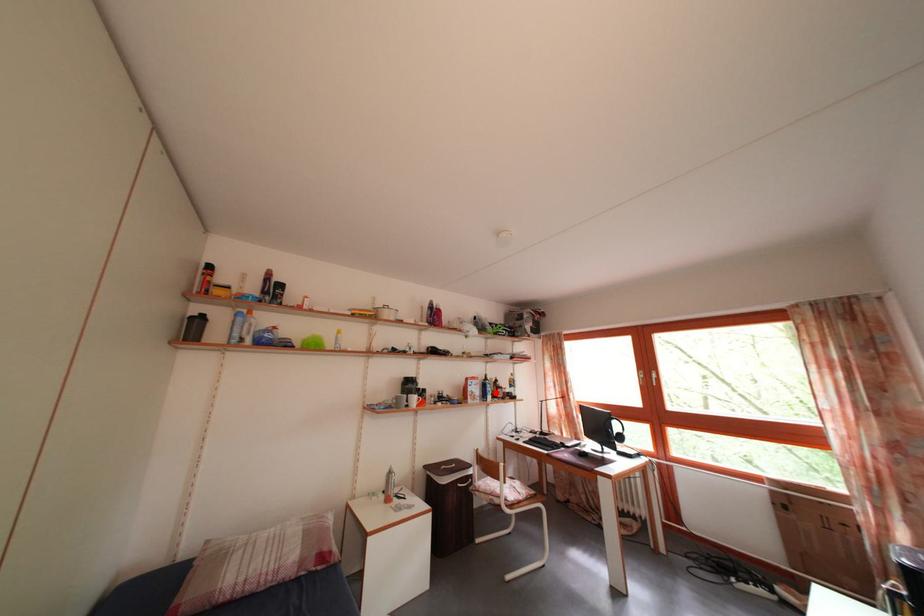
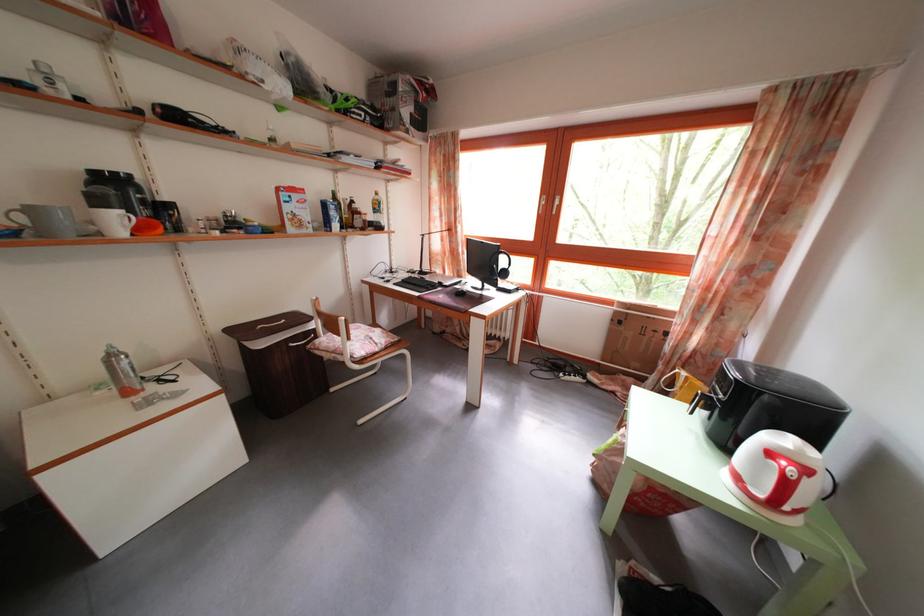
Question: I am providing you with two images of the same scene from different viewpoints. Image1 has a red point marked. In image2, the corresponding 3D location appears at what relative position? Reply with the corresponding letter.

Choices:
 (A) Closer
 (B) Farther

Answer: (A)